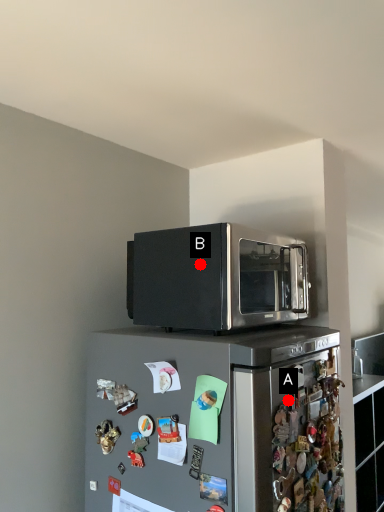
Question: Two points are circled on the image, labeled by A and B beside each circle. Which of the following is the farthest from the observer?

Choices:
 (A) A is further
 (B) B is further

Answer: (B)